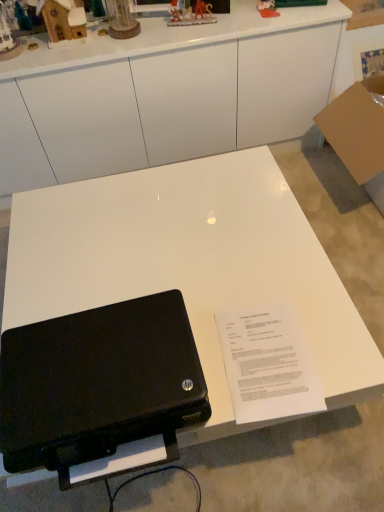
Locate an element on the screen. The image size is (384, 512). free spot in front of wooden house at upper left, the fourth toy in the right-to-left sequence is located at coordinates (62, 54).